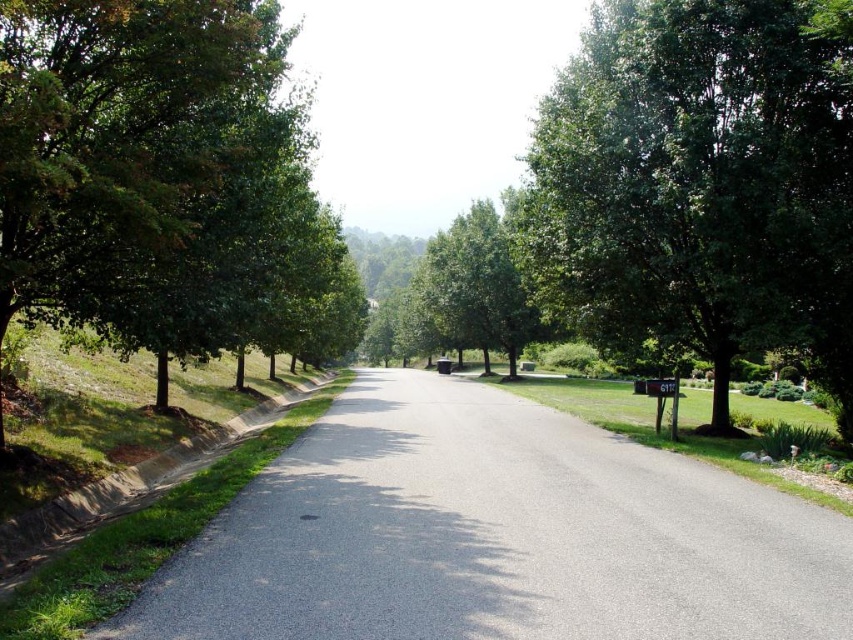
Based on the photo, you are a delivery person driving a truck that is 3 meters wide. You need to pass through the space between the green leafy tree at right and the green leafy tree at left. Can your truck fit through the gap between them?

The green leafy tree at left is behind the green leafy tree at right, so there is no gap between them for the truck to pass through. The truck cannot fit through the space between the green leafy tree at right and the green leafy tree at left.

You are standing at point (x=701, y=184) on the suburban street. What object is located at this point?

The green leafy tree at right is located at point (x=701, y=184).

You are driving a car and want to park near the gray asphalt road at center and the green leafy tree at right. Which object is closer to your current position?

The gray asphalt road at center is closer to the viewer than the green leafy tree at right, so the gray asphalt road at center is closer to your current position.